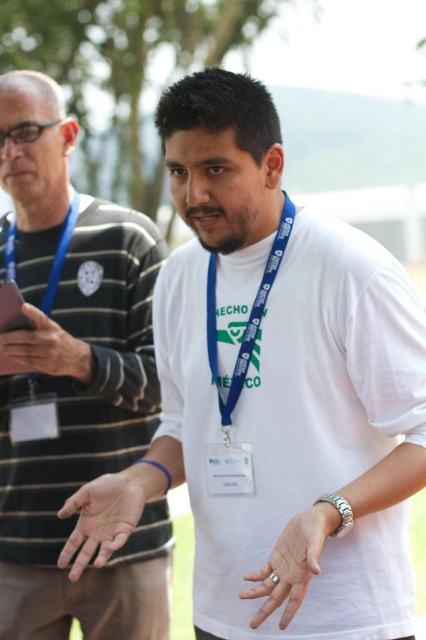
You are a photographer at an event and need to capture a clear photo of both the smooth skin hand at center and the matte blue lanyard at upper left. Based on their positions, which object should you focus on first to ensure both are in frame?

The smooth skin hand at center is positioned on the right side of the matte blue lanyard at upper left. To ensure both are in frame, focus on the matte blue lanyard at upper left first since it is on the left, then adjust to include the hand on the right.

Looking at this image, you are a photographer at the event and need to capture a clear photo of both the matte black phone at left and the matte blue lanyard at upper left. Based on their positions, which object should you focus on first to ensure both are in frame?

You should focus on the matte blue lanyard at upper left first because the matte black phone at left is to the right of it, so adjusting the frame to include both would require starting from the leftmost object.